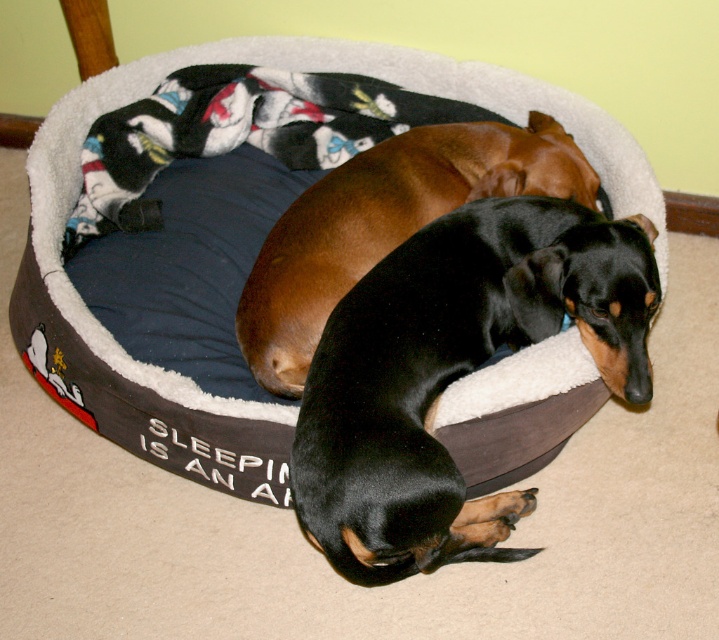
Describe the element at coordinates (454, 372) in the screenshot. I see `black smooth dog at center` at that location.

The height and width of the screenshot is (640, 719). Find the location of `black smooth dog at center`. black smooth dog at center is located at coordinates (454, 372).

Between dark gray plush dog bed at center and brown smooth dog at center, which one is positioned lower?

brown smooth dog at center is below.

Does dark gray plush dog bed at center appear under brown smooth dog at center?

Incorrect, dark gray plush dog bed at center is not positioned below brown smooth dog at center.

What do you see at coordinates (226, 253) in the screenshot?
I see `dark gray plush dog bed at center` at bounding box center [226, 253].

Where is `dark gray plush dog bed at center`? dark gray plush dog bed at center is located at coordinates (226, 253).

Who is positioned more to the right, dark gray plush dog bed at center or black smooth dog at center?

From the viewer's perspective, black smooth dog at center appears more on the right side.

Does dark gray plush dog bed at center come in front of black smooth dog at center?

No, it is not.

Who is more forward, [119,314] or [439,291]?

Positioned in front is point [439,291].

This screenshot has height=640, width=719. I want to click on dark gray plush dog bed at center, so click(226, 253).